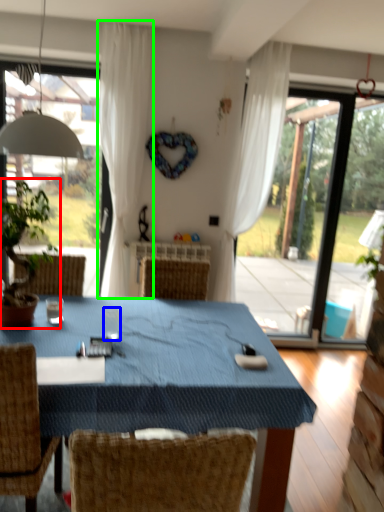
Question: Based on their relative distances, which object is nearer to houseplant (highlighted by a red box)? Choose from coffee cup (highlighted by a blue box) and curtain (highlighted by a green box).

Choices:
 (A) coffee cup
 (B) curtain

Answer: (A)